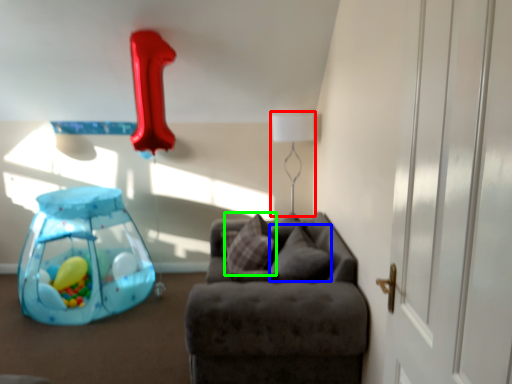
Question: Considering the real-world distances, which object is closest to table lamp (highlighted by a red box)? pillow (highlighted by a blue box) or pillow (highlighted by a green box).

Choices:
 (A) pillow
 (B) pillow

Answer: (B)